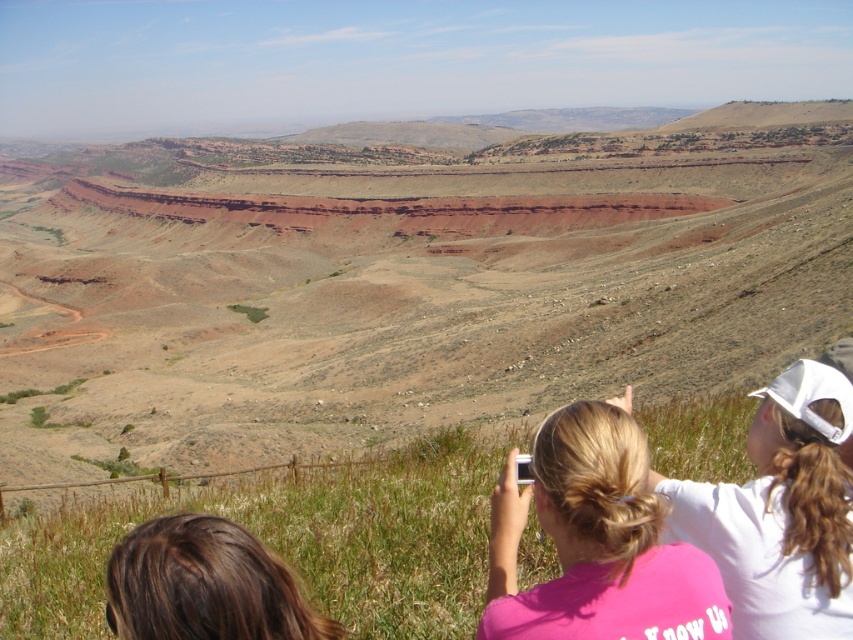
Looking at this image, you are a photographer trying to capture a group photo of the pink fabric shirt at lower right and the brown hair at lower left. Based on their current positions, which subject should you place on your right side to frame them properly?

The pink fabric shirt at lower right should be placed on your right side because it is already positioned on the right side of brown hair at lower left.

You are a photographer trying to capture a photo of the pink fabric at center and the brown hair at lower left. Which object should you zoom in more on to ensure both are clearly visible in the frame?

The pink fabric at center might be wider than brown hair at lower left, so you should zoom in more on the brown hair at lower left to ensure both are clearly visible in the frame.